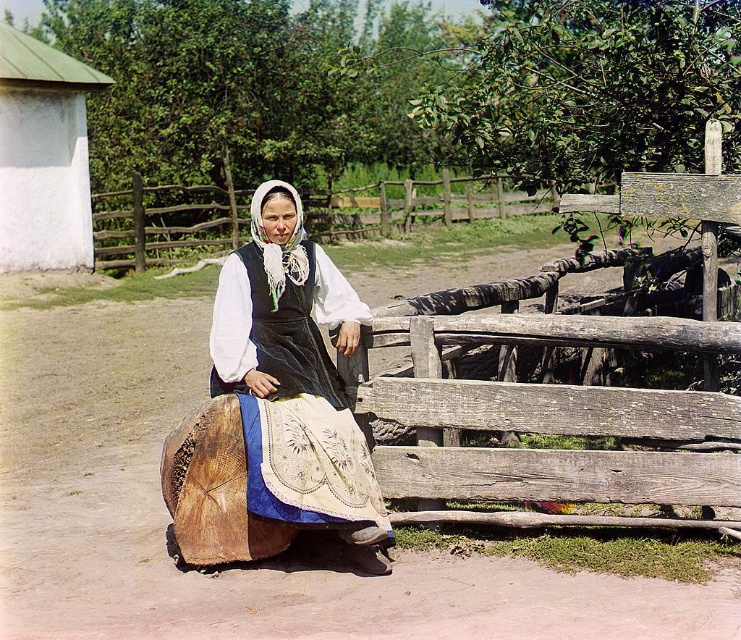
Is white lace headscarf at center wider than wooden at center?

No.

Which is in front, point (330, 470) or point (439, 193)?

Point (330, 470) is in front.

This screenshot has width=741, height=640. In order to click on white lace headscarf at center in this screenshot , I will do `click(295, 378)`.